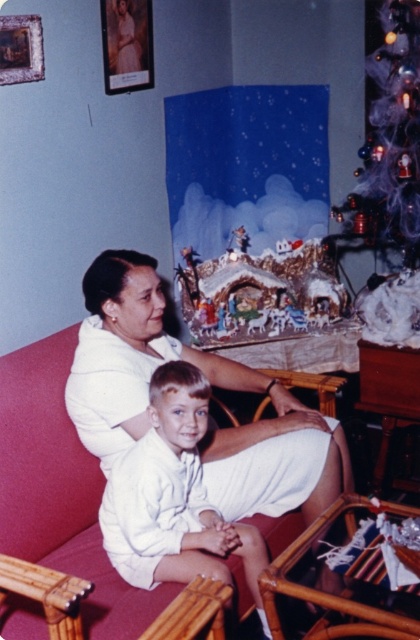
Consider the image. Does light brown hair at center appear over bamboo armchair at lower right?

Correct, light brown hair at center is located above bamboo armchair at lower right.

Which is below, light brown hair at center or bamboo armchair at lower right?

bamboo armchair at lower right

Is point (228, 580) positioned behind point (304, 538)?

No, (228, 580) is closer to viewer.

At what (x,y) coordinates should I click in order to perform the action: click on light brown hair at center. Please return your answer as a coordinate pair (x, y). Image resolution: width=420 pixels, height=640 pixels. Looking at the image, I should click on (173, 497).

Which is behind, point (37, 497) or point (149, 52)?

The point (149, 52) is behind.

Is point (76, 556) more distant than point (131, 16)?

No, (76, 556) is closer to viewer.

Locate an element on the screen. The height and width of the screenshot is (640, 420). velvet red couch at center is located at coordinates (60, 490).

Is the position of matte white portrait at upper left less distant than that of wooden picture frame at upper left?

No, it is not.

Who is positioned more to the right, matte white portrait at upper left or wooden picture frame at upper left?

matte white portrait at upper left is more to the right.

Locate an element on the screen. This screenshot has height=640, width=420. matte white portrait at upper left is located at coordinates (126, 44).